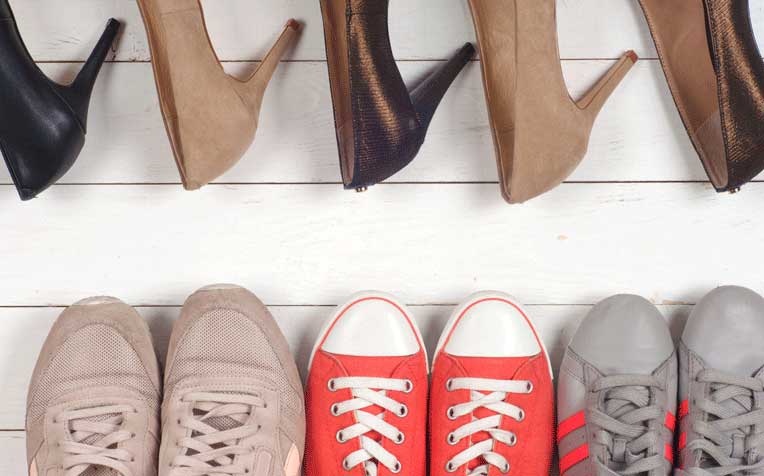
Locate an element on the screen. The height and width of the screenshot is (476, 764). bottom row of shoes is located at coordinates pyautogui.click(x=73, y=414), pyautogui.click(x=215, y=404), pyautogui.click(x=358, y=389), pyautogui.click(x=465, y=386), pyautogui.click(x=606, y=378), pyautogui.click(x=716, y=364).